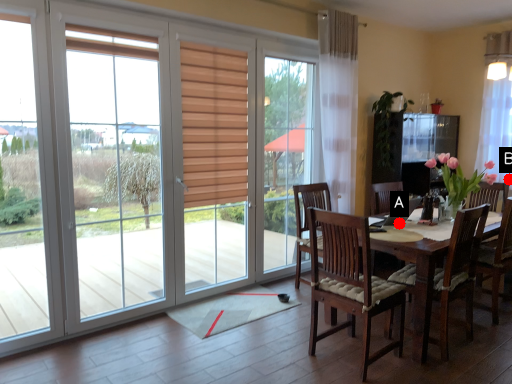
Question: Two points are circled on the image, labeled by A and B beside each circle. Among these points, which one is farthest from the camera?

Choices:
 (A) A is further
 (B) B is further

Answer: (B)